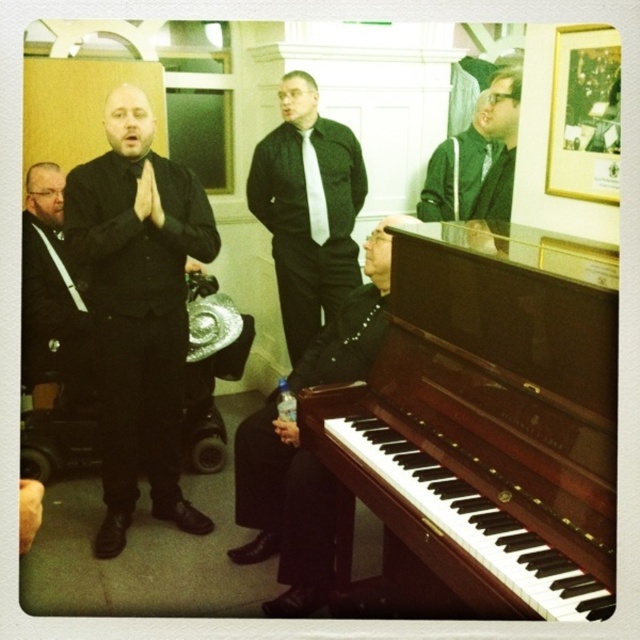
Question: From the image, what is the correct spatial relationship of black leather suit at center in relation to green matte jacket at upper right?

Choices:
 (A) left
 (B) right

Answer: (A)

Question: Which point is closer to the camera?

Choices:
 (A) (284, 548)
 (B) (400, 554)

Answer: (B)

Question: Does black leather suit at center have a larger size compared to green matte jacket at upper center?

Choices:
 (A) yes
 (B) no

Answer: (A)

Question: Considering the real-world distances, which object is closest to the brown polished wood piano at center?

Choices:
 (A) matte black suit at left
 (B) green matte jacket at upper center
 (C) matte black suit at center

Answer: (B)

Question: Which of the following is the closest to the observer?

Choices:
 (A) (477, 189)
 (B) (83, 234)

Answer: (B)

Question: From the image, what is the correct spatial relationship of brown polished wood piano at center in relation to green matte jacket at upper right?

Choices:
 (A) right
 (B) left

Answer: (B)